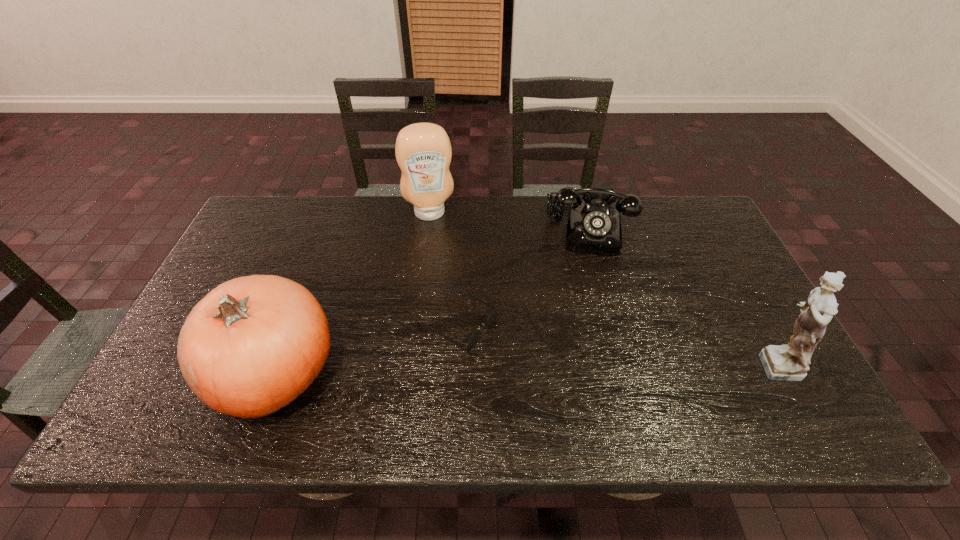
You are a GUI agent. You are given a task and a screenshot of the screen. Output one action in this format:
    pyautogui.click(x=<x>, y=<y>)
    Task: Click on the vacant space at the right edge
    
    Given the screenshot: What is the action you would take?
    pyautogui.click(x=727, y=258)

The image size is (960, 540). Identify the location of vacant space at the far left corner of the desktop. (284, 223).

Where is `free spot between the telephone and the condiment`? free spot between the telephone and the condiment is located at coordinates click(x=511, y=221).

You are a GUI agent. You are given a task and a screenshot of the screen. Output one action in this format:
    pyautogui.click(x=<x>, y=<y>)
    Task: Click on the unoccupied position between the condiment and the fourth tallest object
    
    Given the screenshot: What is the action you would take?
    pyautogui.click(x=511, y=221)

Identify the location of free space between the sunglasses and the condiment. Image resolution: width=960 pixels, height=540 pixels. (444, 268).

At what (x,y) coordinates should I click in order to perform the action: click on free space between the condiment and the sunglasses. Please return your answer as a coordinate pair (x, y). This screenshot has width=960, height=540. Looking at the image, I should click on (444, 268).

Where is `unoccupied position between the figurine and the condiment`? This screenshot has height=540, width=960. unoccupied position between the figurine and the condiment is located at coordinates (601, 288).

Locate an element on the screen. The image size is (960, 540). free point between the condiment and the pumpkin is located at coordinates (352, 293).

At what (x,y) coordinates should I click in order to perform the action: click on free space between the pumpkin and the second object from right to left. Please return your answer as a coordinate pair (x, y). This screenshot has width=960, height=540. Looking at the image, I should click on (433, 300).

Where is `empty space that is in between the figurine and the condiment`? Image resolution: width=960 pixels, height=540 pixels. empty space that is in between the figurine and the condiment is located at coordinates [601, 288].